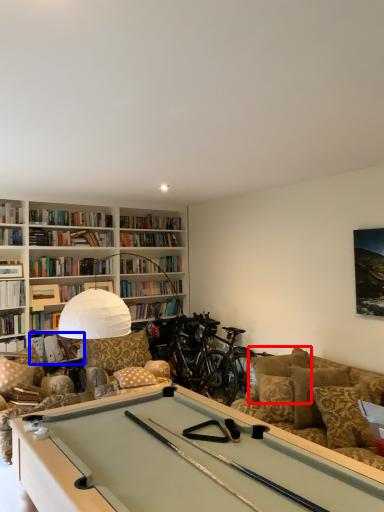
Question: Which of the following is the closest to the observer, pillow (highlighted by a red box) or book (highlighted by a blue box)?

Choices:
 (A) pillow
 (B) book

Answer: (A)